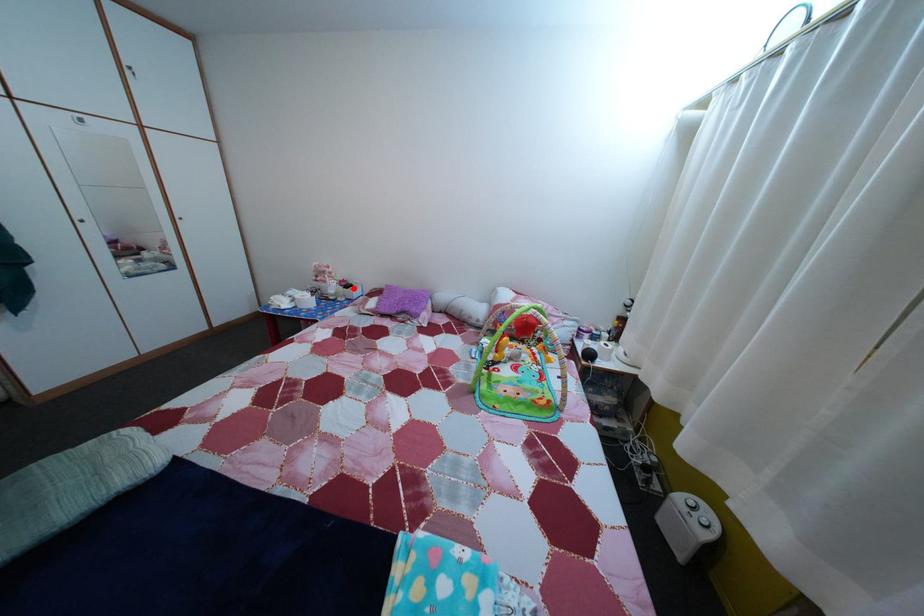
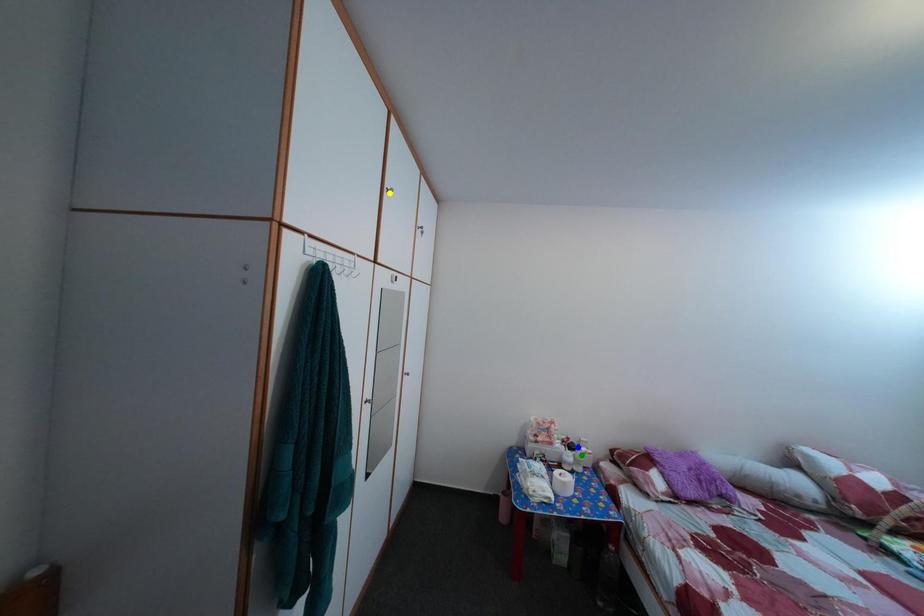
Question: I am providing you with two images of the same scene from different viewpoints. A red point is marked on the first image. You are given multiple points on the second image. Which point in image 2 represents the same 3d spot as the red point in image 1?

Choices:
 (A) green point
 (B) yellow point
 (C) blue point

Answer: (C)